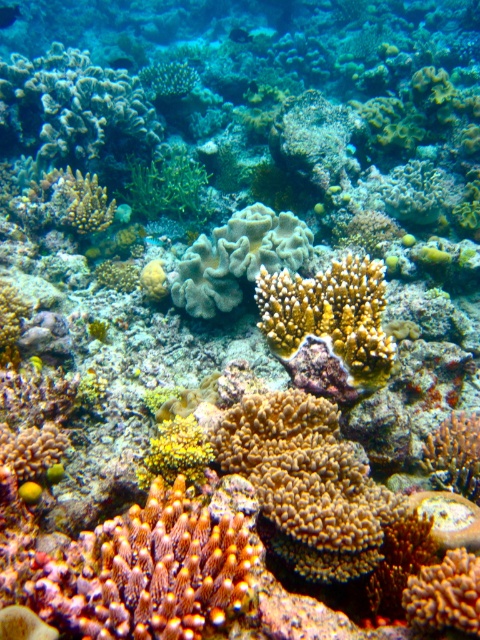
Is brown textured coral at center to the right of yellow coral at center from the viewer's perspective?

No, brown textured coral at center is not to the right of yellow coral at center.

Who is positioned more to the left, brown textured coral at center or yellow coral at center?

From the viewer's perspective, brown textured coral at center appears more on the left side.

Which is in front, point (319, 580) or point (352, 374)?

Point (319, 580) is more forward.

The image size is (480, 640). I want to click on brown textured coral at center, so click(x=307, y=483).

How distant is smooth gray coral at center from translucent blue fish at upper left?

smooth gray coral at center and translucent blue fish at upper left are 5.73 meters apart from each other.

Between point (288, 252) and point (0, 8), which one is positioned in front?

Point (288, 252) is in front.

You are a GUI agent. You are given a task and a screenshot of the screen. Output one action in this format:
    pyautogui.click(x=<x>, y=<y>)
    Task: Click on the smooth gray coral at center
    The width and height of the screenshot is (480, 640).
    Given the screenshot: What is the action you would take?
    pyautogui.click(x=238, y=257)

Does brown textured coral at center have a greater width compared to smooth gray coral at center?

Incorrect, brown textured coral at center's width does not surpass smooth gray coral at center's.

Is the position of brown textured coral at center more distant than that of smooth gray coral at center?

No.

Is point (349, 444) positioned before point (268, 208)?

Yes, point (349, 444) is in front of point (268, 208).

This screenshot has height=640, width=480. I want to click on brown textured coral at center, so click(x=307, y=483).